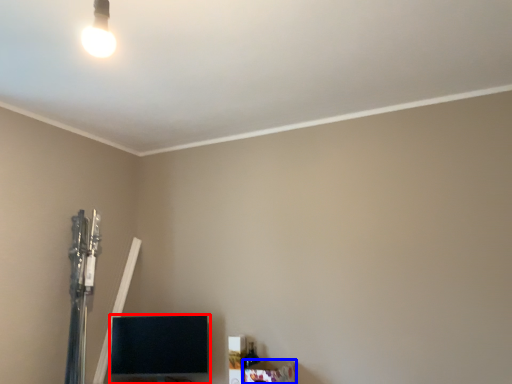
Question: Which object is further to the camera taking this photo, furniture (highlighted by a red box) or furniture (highlighted by a blue box)?

Choices:
 (A) furniture
 (B) furniture

Answer: (A)